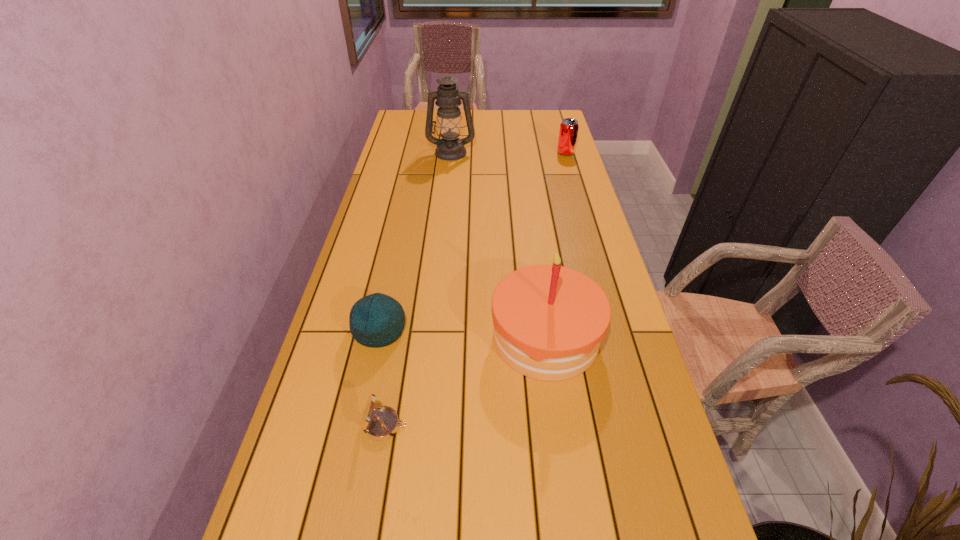
Identify which object is located as the fourth nearest to the compass. Please provide its 2D coordinates. Your answer should be formatted as a tuple, i.e. [(x, y)], where the tuple contains the x and y coordinates of a point satisfying the conditions above.

[(568, 132)]

The width and height of the screenshot is (960, 540). I want to click on free space that satisfies the following two spatial constraints: 1. on the back side of the soda can; 2. on the left side of the birthday cake, so click(x=520, y=153).

The image size is (960, 540). Find the location of `vacant region that satisfies the following two spatial constraints: 1. on the front side of the oil lamp; 2. with the dial facing the nearest object`. vacant region that satisfies the following two spatial constraints: 1. on the front side of the oil lamp; 2. with the dial facing the nearest object is located at coordinates (423, 426).

At what (x,y) coordinates should I click in order to perform the action: click on blank area in the image that satisfies the following two spatial constraints: 1. on the front side of the oil lamp; 2. with the dial facing the compass. Please return your answer as a coordinate pair (x, y). The image size is (960, 540). Looking at the image, I should click on (423, 426).